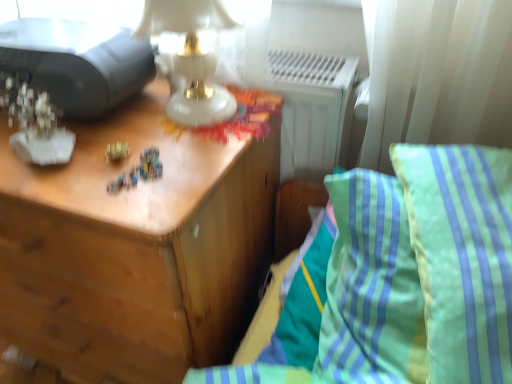
You are a GUI agent. You are given a task and a screenshot of the screen. Output one action in this format:
    pyautogui.click(x=<x>, y=<y>)
    Task: Click on the free space to the left of gold metallic toy at center
    The height and width of the screenshot is (384, 512).
    Given the screenshot: What is the action you would take?
    pyautogui.click(x=53, y=162)